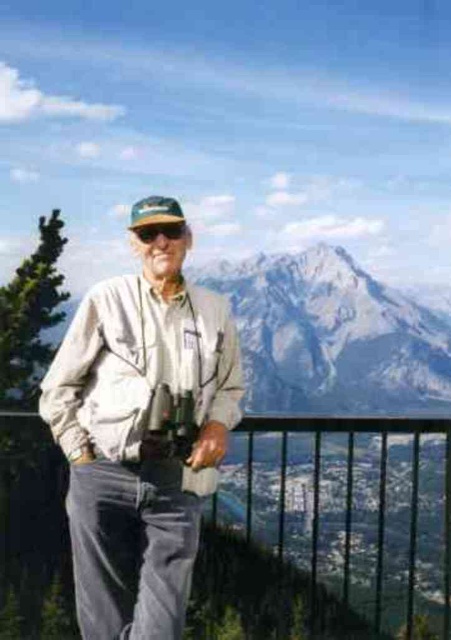
Can you confirm if black metal fence at lower center is bigger than green fabric cap at center?

Yes.

Is black metal fence at lower center shorter than green fabric cap at center?

No.

Which is in front, point (252, 506) or point (179, 205)?

Point (179, 205) is more forward.

The width and height of the screenshot is (451, 640). Find the location of `black metal fence at lower center`. black metal fence at lower center is located at coordinates (330, 531).

What do you see at coordinates (330, 531) in the screenshot? I see `black metal fence at lower center` at bounding box center [330, 531].

Can you confirm if black metal fence at lower center is wider than khaki fabric jacket at center?

Correct, the width of black metal fence at lower center exceeds that of khaki fabric jacket at center.

Describe the element at coordinates (330, 531) in the screenshot. The width and height of the screenshot is (451, 640). I see `black metal fence at lower center` at that location.

Locate an element on the screen. This screenshot has height=640, width=451. black metal fence at lower center is located at coordinates (330, 531).

Is khaki fabric jacket at center shorter than metallic silver binoculars at center?

No, khaki fabric jacket at center is not shorter than metallic silver binoculars at center.

What do you see at coordinates (142, 438) in the screenshot? I see `khaki fabric jacket at center` at bounding box center [142, 438].

The height and width of the screenshot is (640, 451). Find the location of `khaki fabric jacket at center`. khaki fabric jacket at center is located at coordinates (142, 438).